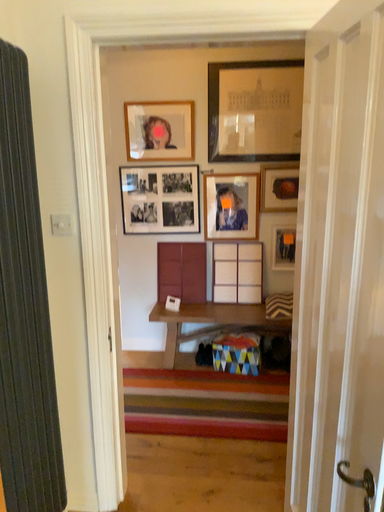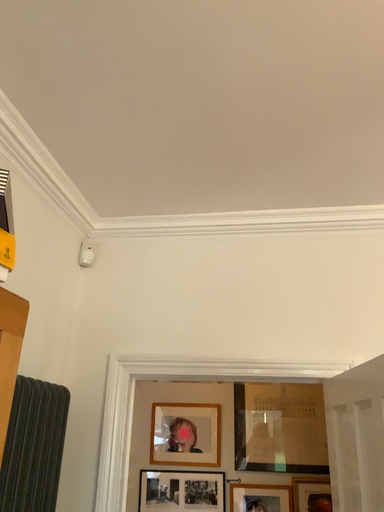
Question: Which way did the camera rotate in the video?

Choices:
 (A) rotated upward
 (B) rotated downward

Answer: (A)